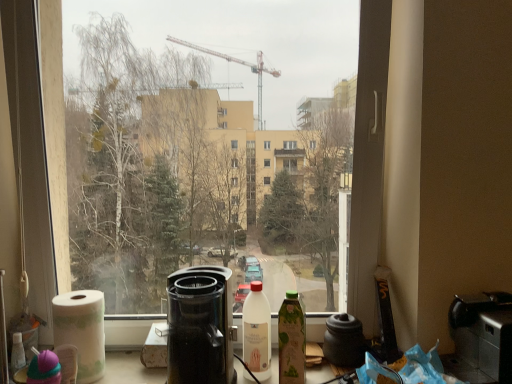
Identify the location of vacant space situated above black plastic coffee maker at center, which ranks as the second appliance in right-to-left order (from a real-world perspective). (201, 280).